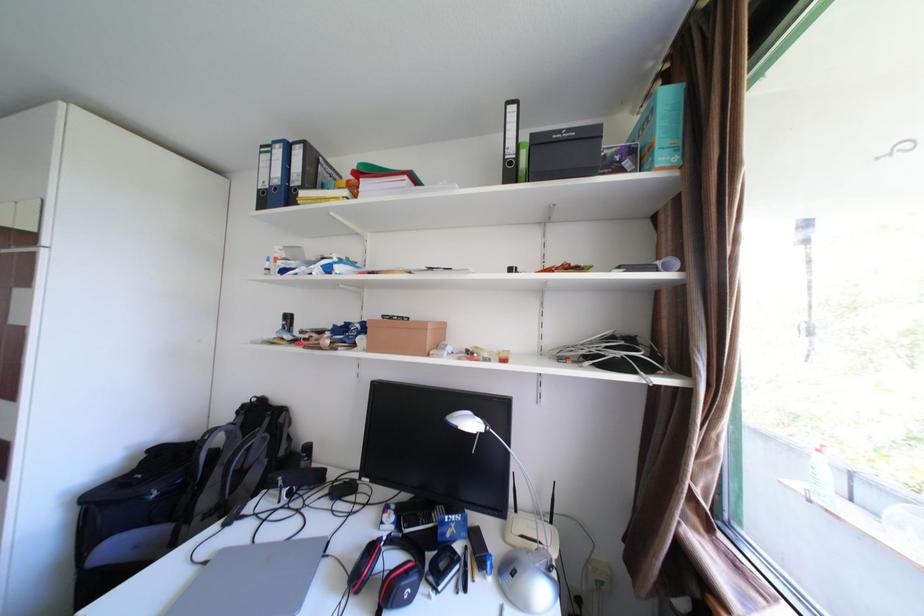
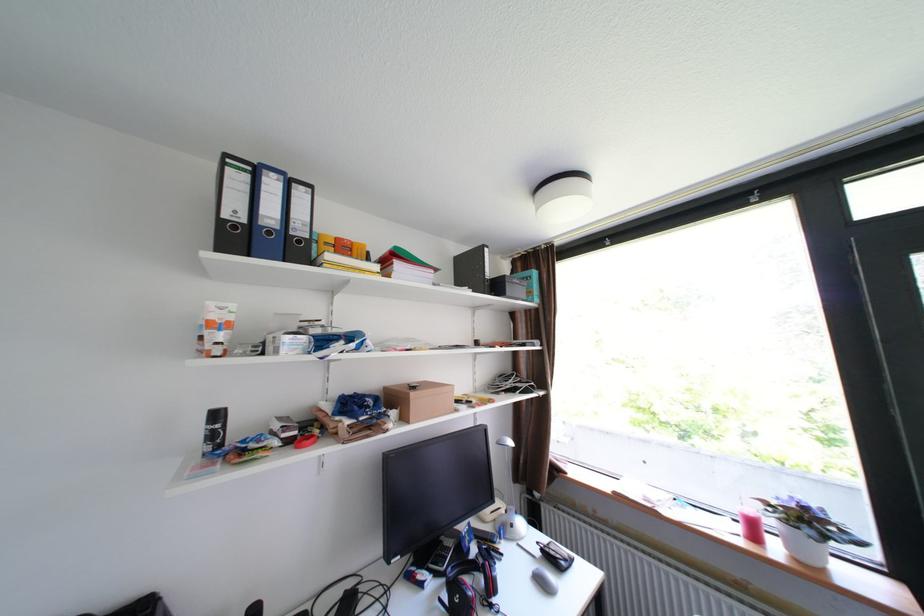
In the second image, find the point that corresponds to the point at 270,191 in the first image.

(232, 221)